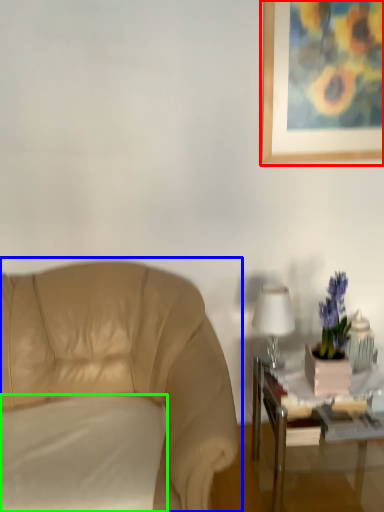
Question: Which object is positioned closest to picture frame (highlighted by a red box)? Select from chair (highlighted by a blue box) and pillow (highlighted by a green box).

Choices:
 (A) chair
 (B) pillow

Answer: (A)